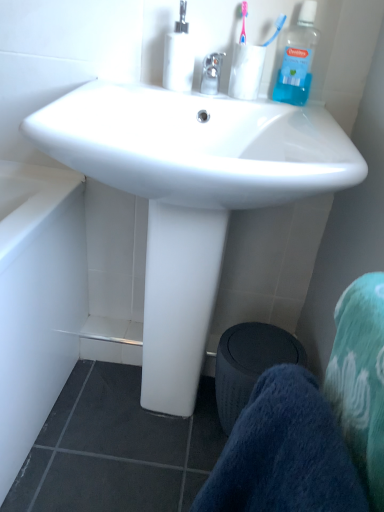
Question: Is clear glass faucet at center situated inside blue plastic toothbrush at upper right or outside?

Choices:
 (A) inside
 (B) outside

Answer: (B)

Question: Would you say clear glass faucet at center is to the left or to the right of blue plastic toothbrush at upper right in the picture?

Choices:
 (A) left
 (B) right

Answer: (A)

Question: Based on their relative distances, which object is nearer to the blue translucent bottle at upper right, which is counted as the second bottle, starting from the left?

Choices:
 (A) black fabric trash bin/can at lower center
 (B) clear glass faucet at center
 (C) transparent plastic soap dispenser at upper center, placed as the first bottle when sorted from left to right
 (D) white glossy sink at center
 (E) blue soft towel at lower right

Answer: (B)

Question: Considering the real-world distances, which object is farthest from the blue plastic toothbrush at upper right?

Choices:
 (A) black fabric trash bin/can at lower center
 (B) transparent plastic cup at upper center
 (C) transparent plastic soap dispenser at upper center, the second bottle from the right
 (D) blue soft towel at lower right
 (E) white glossy sink at center

Answer: (D)